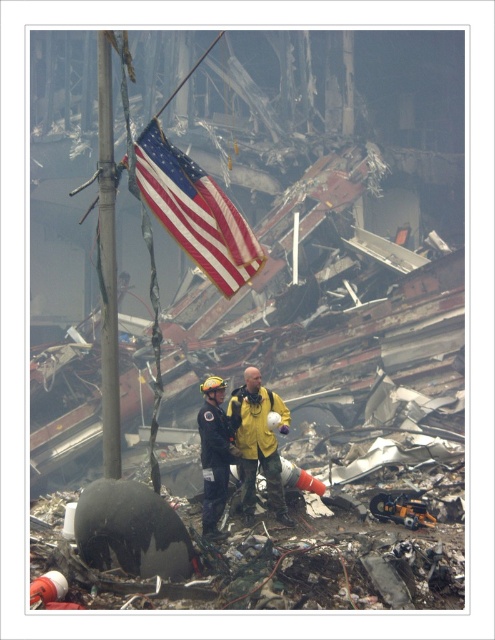
Who is taller, american flag at center or metallic pole at center?

metallic pole at center is taller.

Is american flag at center below metallic pole at center?

Incorrect, american flag at center is not positioned below metallic pole at center.

This screenshot has height=640, width=495. What are the coordinates of `american flag at center` in the screenshot? It's located at (196, 211).

Is american flag at center to the right of black matte uniform at center from the viewer's perspective?

Incorrect, american flag at center is not on the right side of black matte uniform at center.

Based on the photo, does american flag at center have a greater width compared to black matte uniform at center?

Yes, american flag at center is wider than black matte uniform at center.

The height and width of the screenshot is (640, 495). In order to click on american flag at center in this screenshot , I will do `click(196, 211)`.

Locate an element on the screen. This screenshot has width=495, height=640. american flag at center is located at coordinates (196, 211).

At what (x,y) coordinates should I click in order to perform the action: click on american flag at center. Please return your answer as a coordinate pair (x, y). The height and width of the screenshot is (640, 495). Looking at the image, I should click on (196, 211).

Who is more distant from viewer, (171, 196) or (248, 483)?

Positioned behind is point (248, 483).

The height and width of the screenshot is (640, 495). In order to click on american flag at center in this screenshot , I will do `click(196, 211)`.